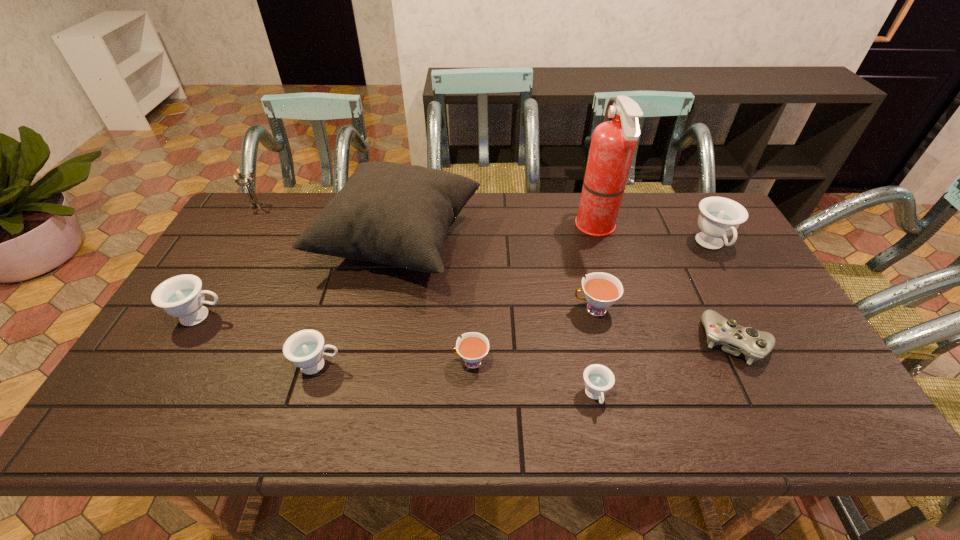
Where is `vacant space located 0.050m on the side of the third teacup from left to right with the handle`? vacant space located 0.050m on the side of the third teacup from left to right with the handle is located at coordinates (432, 362).

Where is `free spot located 0.320m on the side of the third teacup from left to right with the handle`? The height and width of the screenshot is (540, 960). free spot located 0.320m on the side of the third teacup from left to right with the handle is located at coordinates tap(322, 362).

You are a GUI agent. You are given a task and a screenshot of the screen. Output one action in this format:
    pyautogui.click(x=<x>, y=<y>)
    Task: Click on the fire extinguisher that is positioned at the far edge
    The height and width of the screenshot is (540, 960).
    Given the screenshot: What is the action you would take?
    pyautogui.click(x=613, y=143)

Identify the location of cushion located in the far edge section of the desktop. (395, 214).

The image size is (960, 540). Find the location of `candle holder that is at the far edge`. candle holder that is at the far edge is located at coordinates click(254, 201).

This screenshot has height=540, width=960. I want to click on teacup present at the far edge, so click(719, 217).

The image size is (960, 540). I want to click on object located at the near edge, so click(x=598, y=378).

This screenshot has width=960, height=540. What are the coordinates of `candle holder located in the left edge section of the desktop` in the screenshot? It's located at (254, 201).

You are a GUI agent. You are given a task and a screenshot of the screen. Output one action in this format:
    pyautogui.click(x=<x>, y=<y>)
    Task: Click on the teacup that is at the left edge
    
    Given the screenshot: What is the action you would take?
    pyautogui.click(x=181, y=296)

At what (x,y) coordinates should I click in order to perform the action: click on teacup located at the right edge. Please return your answer as a coordinate pair (x, y). Looking at the image, I should click on (719, 217).